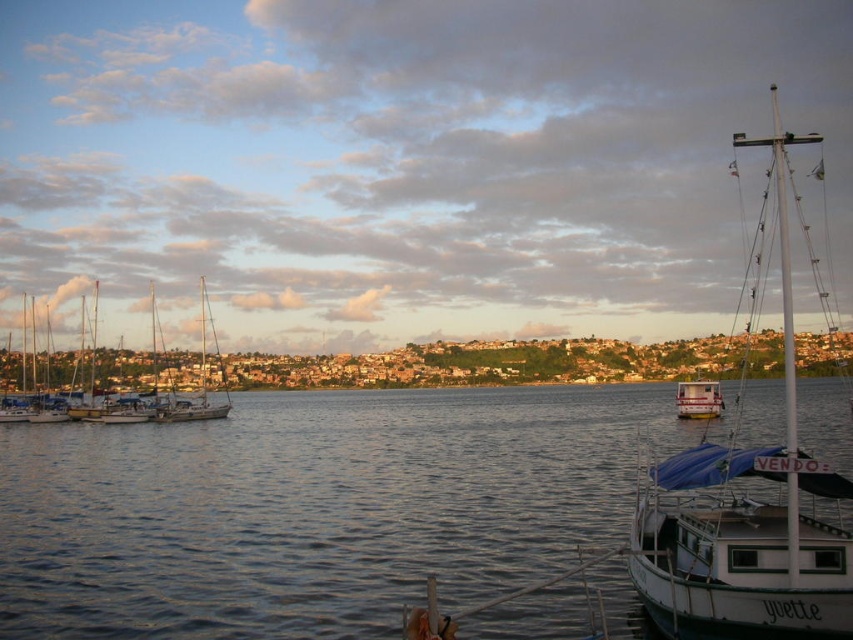
You are a photographer planning to capture the waterfront scene. You want to ensure that the clear water at center and the white matte boat at right are both visible in your shot. Based on their sizes, which object will occupy more of the frame?

The clear water at center is larger in size than the white matte boat at right, so it will occupy more of the frame.

You are a photographer planning to capture a wide shot of the waterfront scene. You want to ensure the clear water at center and the white sailboat at left are both visible in the frame. Based on their sizes, which object will occupy more space in your photo?

The clear water at center will occupy more space in the photo because its width is larger than that of the white sailboat at left.